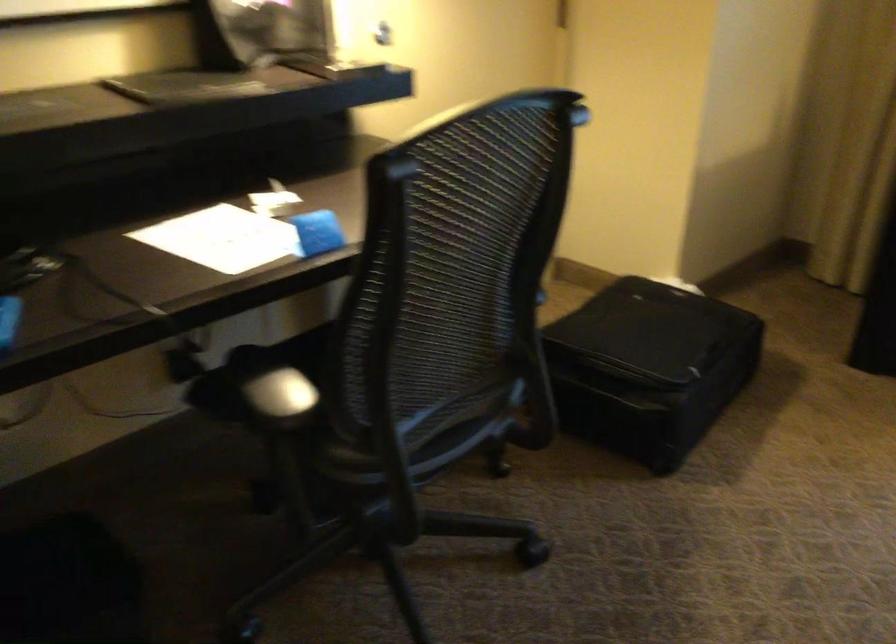
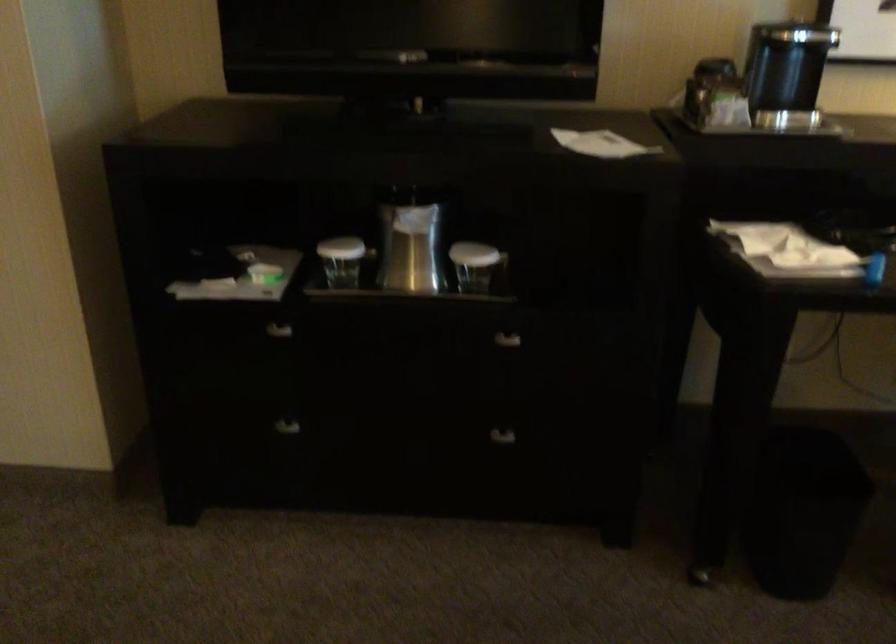
Question: The images are taken continuously from a first-person perspective. In which direction is your viewpoint rotating?

Choices:
 (A) Left
 (B) Right
 (C) Up
 (D) Down

Answer: (A)